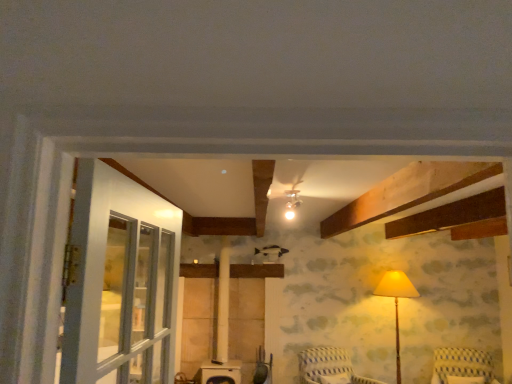
Question: Does yellow striped fabric chair at lower right, the first furniture when ordered from right to left, have a larger size compared to striped fabric chair at lower center, the second furniture in the right-to-left sequence?

Choices:
 (A) no
 (B) yes

Answer: (A)

Question: Is yellow striped fabric chair at lower right, the first furniture when ordered from right to left, at the left side of striped fabric chair at lower center, the second furniture in the right-to-left sequence?

Choices:
 (A) no
 (B) yes

Answer: (A)

Question: Is yellow striped fabric chair at lower right, which is the second furniture from left to right, surrounding striped fabric chair at lower center, the second furniture in the right-to-left sequence?

Choices:
 (A) yes
 (B) no

Answer: (B)

Question: Are yellow striped fabric chair at lower right, which is the second furniture from left to right, and striped fabric chair at lower center, acting as the first furniture starting from the left, far apart?

Choices:
 (A) no
 (B) yes

Answer: (B)

Question: Considering the relative sizes of yellow striped fabric chair at lower right, the first furniture when ordered from right to left, and striped fabric chair at lower center, the second furniture in the right-to-left sequence, in the image provided, is yellow striped fabric chair at lower right, the first furniture when ordered from right to left, thinner than striped fabric chair at lower center, the second furniture in the right-to-left sequence,?

Choices:
 (A) no
 (B) yes

Answer: (B)

Question: Can you confirm if yellow striped fabric chair at lower right, which is the second furniture from left to right, is smaller than striped fabric chair at lower center, the second furniture in the right-to-left sequence?

Choices:
 (A) yes
 (B) no

Answer: (A)

Question: Is matte yellow fabric lampshade at right further to camera compared to striped fabric chair at lower center, acting as the first furniture starting from the left?

Choices:
 (A) no
 (B) yes

Answer: (B)

Question: Is matte yellow fabric lampshade at right shorter than striped fabric chair at lower center, acting as the first furniture starting from the left?

Choices:
 (A) no
 (B) yes

Answer: (A)

Question: Does matte yellow fabric lampshade at right have a larger size compared to striped fabric chair at lower center, the second furniture in the right-to-left sequence?

Choices:
 (A) yes
 (B) no

Answer: (A)

Question: Is matte yellow fabric lampshade at right turned away from striped fabric chair at lower center, the second furniture in the right-to-left sequence?

Choices:
 (A) no
 (B) yes

Answer: (A)

Question: Is matte yellow fabric lampshade at right to the left of striped fabric chair at lower center, the second furniture in the right-to-left sequence, from the viewer's perspective?

Choices:
 (A) no
 (B) yes

Answer: (A)

Question: Can you confirm if matte yellow fabric lampshade at right is positioned to the right of striped fabric chair at lower center, acting as the first furniture starting from the left?

Choices:
 (A) yes
 (B) no

Answer: (A)

Question: Does striped fabric chair at lower center, acting as the first furniture starting from the left, have a lesser height compared to yellow striped fabric chair at lower right, the first furniture when ordered from right to left?

Choices:
 (A) no
 (B) yes

Answer: (A)